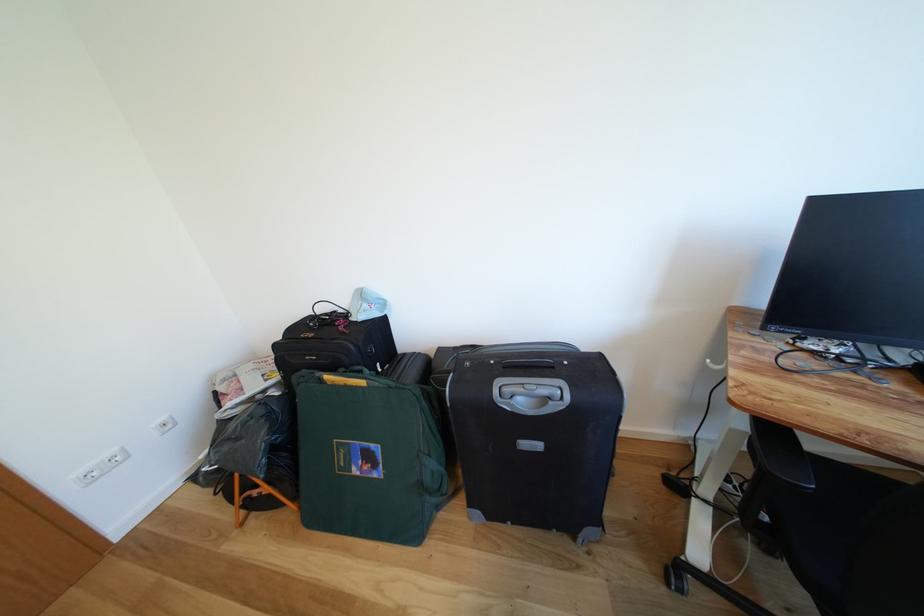
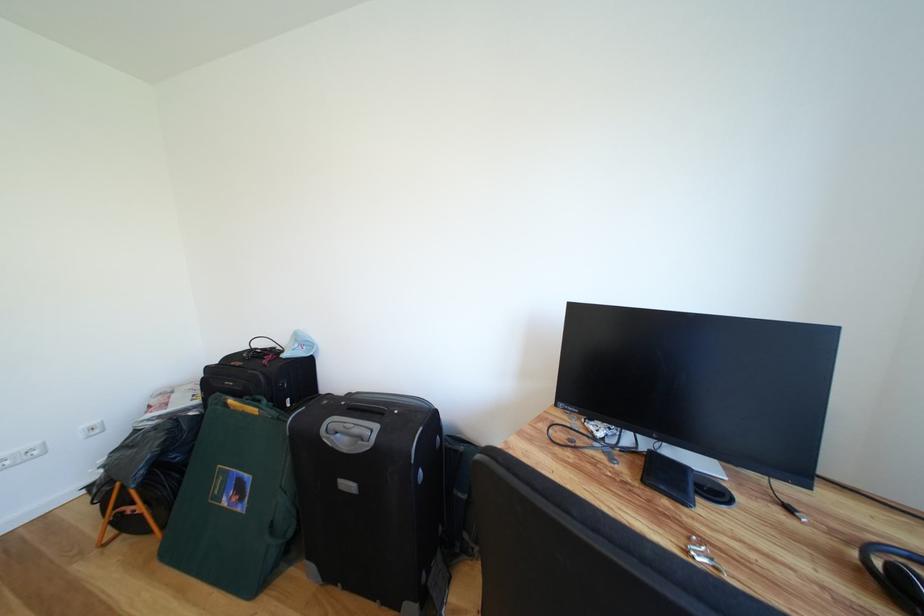
Locate, in the second image, the point that corresponds to [363,476] in the first image.

(234, 506)